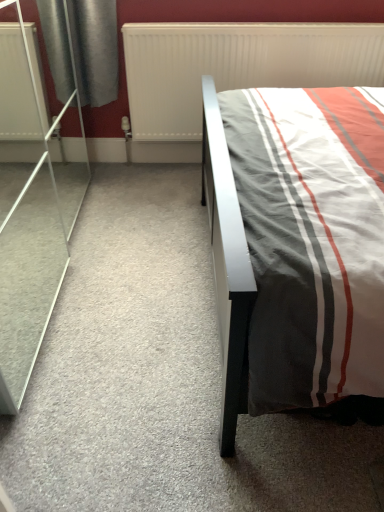
Question: Can you confirm if white textured radiator at upper center is bigger than transparent glass screen door at left?

Choices:
 (A) no
 (B) yes

Answer: (A)

Question: From a real-world perspective, is white textured radiator at upper center on transparent glass screen door at left?

Choices:
 (A) yes
 (B) no

Answer: (B)

Question: Is white textured radiator at upper center positioned in front of transparent glass screen door at left?

Choices:
 (A) no
 (B) yes

Answer: (A)

Question: Can transparent glass screen door at left be found inside white textured radiator at upper center?

Choices:
 (A) no
 (B) yes

Answer: (A)

Question: Does white textured radiator at upper center appear on the right side of transparent glass screen door at left?

Choices:
 (A) no
 (B) yes

Answer: (B)

Question: Does white textured radiator at upper center have a greater height compared to transparent glass screen door at left?

Choices:
 (A) yes
 (B) no

Answer: (B)

Question: Does transparent glass screen door at left have a greater height compared to white textured radiator at upper center?

Choices:
 (A) no
 (B) yes

Answer: (B)

Question: Is transparent glass screen door at left not near white textured radiator at upper center?

Choices:
 (A) no
 (B) yes

Answer: (A)

Question: Is transparent glass screen door at left at the left side of white textured radiator at upper center?

Choices:
 (A) no
 (B) yes

Answer: (B)

Question: From a real-world perspective, is transparent glass screen door at left beneath white textured radiator at upper center?

Choices:
 (A) no
 (B) yes

Answer: (A)

Question: Can we say transparent glass screen door at left lies outside white textured radiator at upper center?

Choices:
 (A) no
 (B) yes

Answer: (B)

Question: Considering the relative sizes of transparent glass screen door at left and white textured radiator at upper center in the image provided, is transparent glass screen door at left bigger than white textured radiator at upper center?

Choices:
 (A) yes
 (B) no

Answer: (A)

Question: Considering the positions of white textured radiator at upper center and transparent glass screen door at left in the image, is white textured radiator at upper center bigger or smaller than transparent glass screen door at left?

Choices:
 (A) big
 (B) small

Answer: (B)